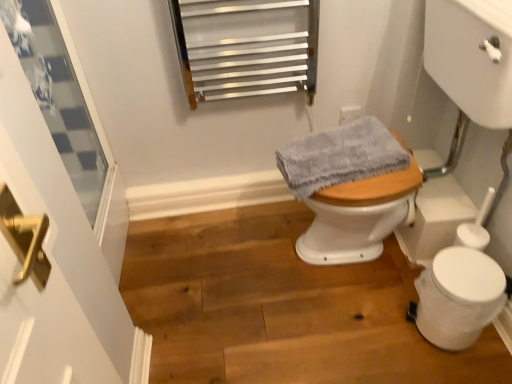
The image size is (512, 384). I want to click on free space behind white plastic toilet bowl at lower right, so click(396, 279).